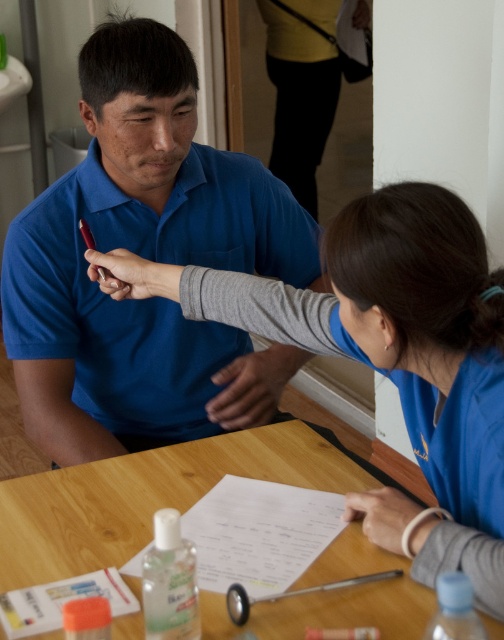
Question: Can you confirm if blue fabric shirt at upper center is positioned above wooden table at center?

Choices:
 (A) yes
 (B) no

Answer: (A)

Question: Which point is farther from the camera taking this photo?

Choices:
 (A) (438, 339)
 (B) (356, 588)

Answer: (B)

Question: Can you confirm if matte blue shirt at center is positioned below wooden table at center?

Choices:
 (A) no
 (B) yes

Answer: (A)

Question: Is matte blue shirt at center positioned behind blue fabric shirt at upper center?

Choices:
 (A) yes
 (B) no

Answer: (A)

Question: Which object is closer to the camera taking this photo?

Choices:
 (A) blue fabric shirt at upper center
 (B) wooden table at center

Answer: (A)

Question: Which point is farther to the camera?

Choices:
 (A) (118, 474)
 (B) (315, 308)

Answer: (A)